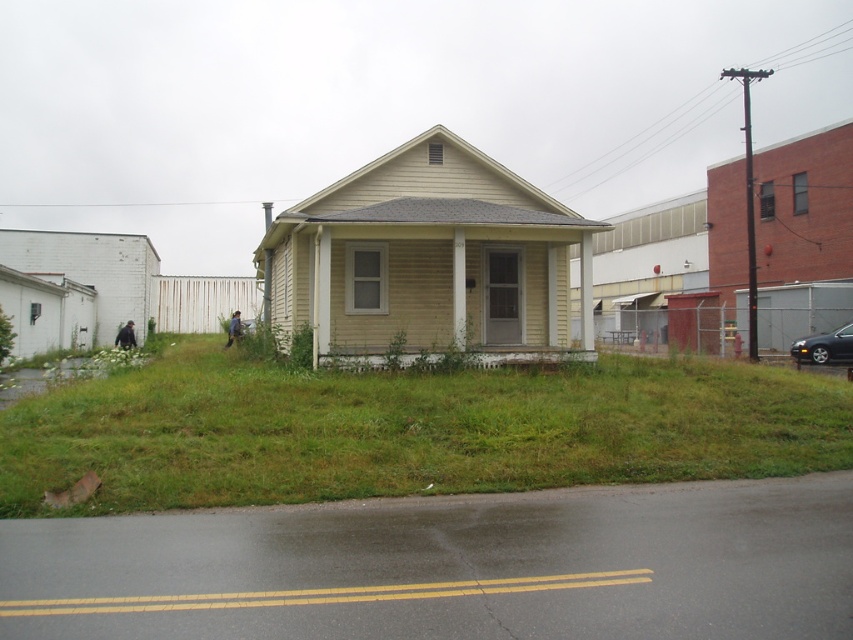
Can you confirm if green grassy at center is taller than shiny silver sedan at lower right?

No, green grassy at center is not taller than shiny silver sedan at lower right.

Is point (9, 467) less distant than point (801, 355)?

Yes, point (9, 467) is closer to viewer.

Which is in front, point (520, 474) or point (850, 348)?

Positioned in front is point (520, 474).

Identify the location of green grassy at center. (409, 429).